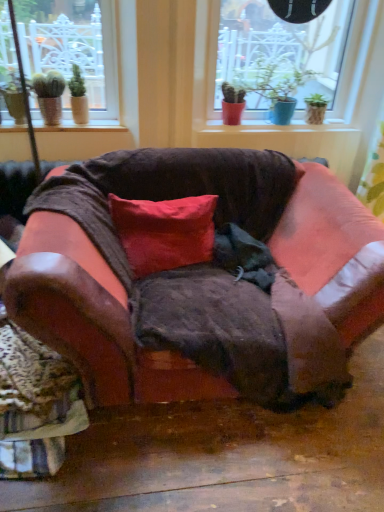
I want to click on blank space situated above smooth ceramic pots at center, marked as the 1th window sill in a right-to-left arrangement (from a real-world perspective), so click(254, 122).